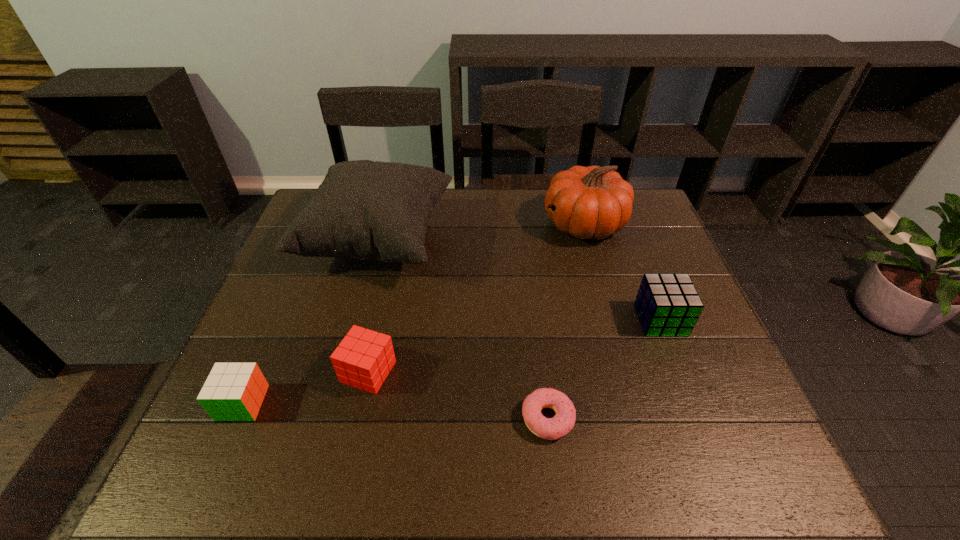
Find the location of a particular element. The height and width of the screenshot is (540, 960). cube at the left edge is located at coordinates (233, 391).

Identify the location of pumpkin located in the right edge section of the desktop. The height and width of the screenshot is (540, 960). (593, 202).

The width and height of the screenshot is (960, 540). In order to click on cube present at the right edge in this screenshot , I will do `click(667, 305)`.

You are a GUI agent. You are given a task and a screenshot of the screen. Output one action in this format:
    pyautogui.click(x=<x>, y=<y>)
    Task: Click on the object that is at the far left corner
    
    Given the screenshot: What is the action you would take?
    pyautogui.click(x=366, y=210)

Identify the location of object present at the far right corner. (593, 202).

In the image, there is a desktop. Where is `vacant space at the far edge`? The height and width of the screenshot is (540, 960). vacant space at the far edge is located at coordinates (450, 217).

What are the coordinates of `free spot at the near edge of the desktop` in the screenshot? It's located at (642, 455).

Find the location of a particular element. Image resolution: width=960 pixels, height=540 pixels. free space at the left edge of the desktop is located at coordinates (311, 341).

Identify the location of free space at the right edge. (678, 432).

This screenshot has height=540, width=960. In order to click on free space at the near left corner in this screenshot , I will do `click(206, 461)`.